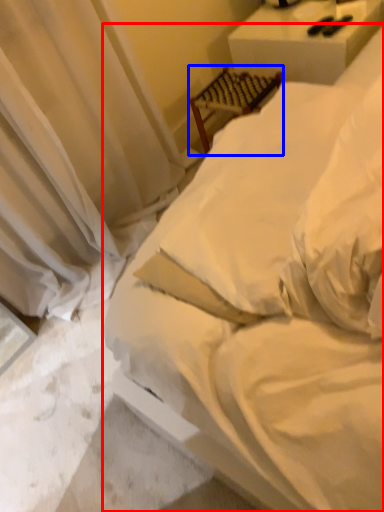
Question: Among these objects, which one is nearest to the camera, bed (highlighted by a red box) or furniture (highlighted by a blue box)?

Choices:
 (A) bed
 (B) furniture

Answer: (A)